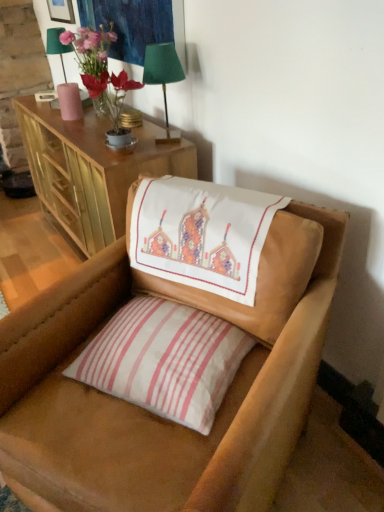
Question: From a real-world perspective, is wooden cabinet at upper left beneath white striped pillow at center?

Choices:
 (A) yes
 (B) no

Answer: (A)

Question: Can you confirm if wooden cabinet at upper left is wider than white striped pillow at center?

Choices:
 (A) no
 (B) yes

Answer: (B)

Question: Is wooden cabinet at upper left facing away from white striped pillow at center?

Choices:
 (A) yes
 (B) no

Answer: (B)

Question: Considering the relative sizes of wooden cabinet at upper left and white striped pillow at center in the image provided, is wooden cabinet at upper left shorter than white striped pillow at center?

Choices:
 (A) yes
 (B) no

Answer: (B)

Question: Does wooden cabinet at upper left touch white striped pillow at center?

Choices:
 (A) no
 (B) yes

Answer: (A)

Question: Is white striped pillow at center inside the boundaries of green fabric lampshade at upper center, the 1th table lamp in the bottom-to-top sequence, or outside?

Choices:
 (A) outside
 (B) inside

Answer: (A)

Question: In terms of size, does white striped pillow at center appear bigger or smaller than green fabric lampshade at upper center, the 1th table lamp in the bottom-to-top sequence?

Choices:
 (A) small
 (B) big

Answer: (B)

Question: Based on their positions, is white striped pillow at center located to the left or right of green fabric lampshade at upper center, the 1th table lamp from the right?

Choices:
 (A) right
 (B) left

Answer: (A)

Question: From a real-world perspective, relative to green fabric lampshade at upper center, positioned as the second table lamp in back-to-front order, is white striped pillow at center vertically above or below?

Choices:
 (A) below
 (B) above

Answer: (A)

Question: Considering their positions, is matte glass vase at upper left located in front of or behind embroidered fabric at upper left?

Choices:
 (A) behind
 (B) front

Answer: (A)

Question: From a real-world perspective, is matte glass vase at upper left positioned above or below embroidered fabric at upper left?

Choices:
 (A) above
 (B) below

Answer: (B)

Question: Is point (109, 104) closer or farther from the camera than point (122, 20)?

Choices:
 (A) farther
 (B) closer

Answer: (B)

Question: From the image's perspective, is matte glass vase at upper left above or below embroidered fabric at upper left?

Choices:
 (A) above
 (B) below

Answer: (B)

Question: Is white striped pillow at center spatially inside leather chair at center, or outside of it?

Choices:
 (A) outside
 (B) inside

Answer: (B)

Question: From the image's perspective, is white striped pillow at center positioned above or below leather chair at center?

Choices:
 (A) above
 (B) below

Answer: (A)